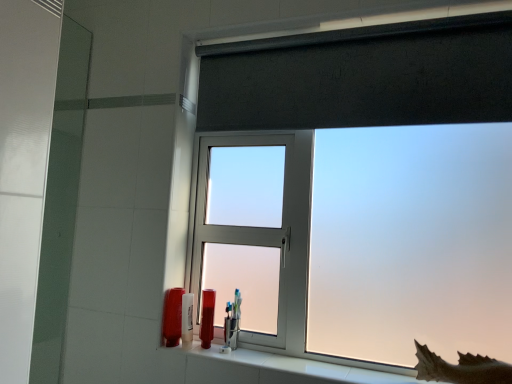
Where is `frosted glass window at upper center`? This screenshot has height=384, width=512. frosted glass window at upper center is located at coordinates (362, 76).

The image size is (512, 384). Describe the element at coordinates (207, 318) in the screenshot. I see `translucent plastic tube at lower center, marked as the second toiletry in a right-to-left arrangement` at that location.

What do you see at coordinates (187, 320) in the screenshot? The image size is (512, 384). I see `translucent plastic toothbrush at lower center, which appears as the third toiletry when viewed from the right` at bounding box center [187, 320].

At what (x,y) coordinates should I click in order to perform the action: click on black textured roller blind at upper center. Please return your answer as a coordinate pair (x, y). This screenshot has width=512, height=384. Looking at the image, I should click on (362, 77).

Where is `matte glass screen door at left`? The height and width of the screenshot is (384, 512). matte glass screen door at left is located at coordinates (24, 167).

Locate an element on the screen. The width and height of the screenshot is (512, 384). frosted plastic shark fin at lower right is located at coordinates (461, 368).

Locate an element on the screen. matte plastic toothbrush at lower left, arranged as the 4th toiletry when viewed from the right is located at coordinates (172, 316).

Which object is thinner, translucent plastic toothbrush at lower center, the second toiletry when ordered from left to right, or clear plastic toothbrush holder at center, the fourth toiletry when ordered from left to right?

With smaller width is translucent plastic toothbrush at lower center, the second toiletry when ordered from left to right.

From a real-world perspective, is translucent plastic toothbrush at lower center, the second toiletry when ordered from left to right, on clear plastic toothbrush holder at center, the fourth toiletry when ordered from left to right?

Incorrect, from a real-world perspective, translucent plastic toothbrush at lower center, the second toiletry when ordered from left to right, is lower than clear plastic toothbrush holder at center, the fourth toiletry when ordered from left to right.

From the image's perspective, is translucent plastic toothbrush at lower center, which appears as the third toiletry when viewed from the right, on top of clear plastic toothbrush holder at center, the 1th toiletry viewed from the right?

Correct, translucent plastic toothbrush at lower center, which appears as the third toiletry when viewed from the right, appears higher than clear plastic toothbrush holder at center, the 1th toiletry viewed from the right, in the image.

Is frosted glass window at upper center thinner than black textured roller blind at upper center?

No.

Could you tell me if frosted glass window at upper center is turned towards black textured roller blind at upper center?

Yes, frosted glass window at upper center is turned towards black textured roller blind at upper center.

Find the location of a particular element. window in front of the black textured roller blind at upper center is located at coordinates (362, 76).

Which of these two, frosted glass window at upper center or black textured roller blind at upper center, is smaller?

black textured roller blind at upper center is smaller.

Considering the relative positions of matte glass screen door at left and frosted plastic shark fin at lower right in the image provided, is matte glass screen door at left to the right of frosted plastic shark fin at lower right from the viewer's perspective?

In fact, matte glass screen door at left is to the left of frosted plastic shark fin at lower right.

Can you confirm if matte glass screen door at left is bigger than frosted plastic shark fin at lower right?

Correct, matte glass screen door at left is larger in size than frosted plastic shark fin at lower right.

The image size is (512, 384). Find the location of `animal located underneath the matte glass screen door at left (from a real-world perspective)`. animal located underneath the matte glass screen door at left (from a real-world perspective) is located at coordinates (461, 368).

Is matte glass screen door at left closer to the viewer compared to frosted plastic shark fin at lower right?

No, it is not.

Is clear plastic toothbrush holder at center, the fourth toiletry when ordered from left to right, thinner than translucent plastic toothbrush at lower center, the second toiletry when ordered from left to right?

In fact, clear plastic toothbrush holder at center, the fourth toiletry when ordered from left to right, might be wider than translucent plastic toothbrush at lower center, the second toiletry when ordered from left to right.

From a real-world perspective, who is located higher, clear plastic toothbrush holder at center, the fourth toiletry when ordered from left to right, or translucent plastic toothbrush at lower center, which appears as the third toiletry when viewed from the right?

clear plastic toothbrush holder at center, the fourth toiletry when ordered from left to right, from a real-world perspective.

Consider the image. Is clear plastic toothbrush holder at center, the 1th toiletry viewed from the right, oriented away from translucent plastic toothbrush at lower center, which appears as the third toiletry when viewed from the right?

clear plastic toothbrush holder at center, the 1th toiletry viewed from the right, is not turned away from translucent plastic toothbrush at lower center, which appears as the third toiletry when viewed from the right.

Is translucent plastic tube at lower center, marked as the second toiletry in a right-to-left arrangement, situated inside frosted plastic shark fin at lower right or outside?

The correct answer is: outside.

Which is farther from the camera, (210, 305) or (442, 364)?

Point (210, 305)

From the image's perspective, is translucent plastic tube at lower center, the 3th toiletry viewed from the left, on top of frosted plastic shark fin at lower right?

Yes, from the image's perspective, translucent plastic tube at lower center, the 3th toiletry viewed from the left, is over frosted plastic shark fin at lower right.

Consider the image. From a real-world perspective, between translucent plastic tube at lower center, marked as the second toiletry in a right-to-left arrangement, and frosted plastic shark fin at lower right, who is vertically higher?

In real-world perspective, translucent plastic tube at lower center, marked as the second toiletry in a right-to-left arrangement, is above.

Is white ceramic window sill at lower center facing towards matte plastic toothbrush at lower left, which ranks as the 1th toiletry in left-to-right order?

No, white ceramic window sill at lower center is not aimed at matte plastic toothbrush at lower left, which ranks as the 1th toiletry in left-to-right order.

Would you consider white ceramic window sill at lower center to be distant from matte plastic toothbrush at lower left, arranged as the 4th toiletry when viewed from the right?

No, white ceramic window sill at lower center is not far from matte plastic toothbrush at lower left, arranged as the 4th toiletry when viewed from the right.

Between white ceramic window sill at lower center and matte plastic toothbrush at lower left, which ranks as the 1th toiletry in left-to-right order, which one has more height?

Standing taller between the two is matte plastic toothbrush at lower left, which ranks as the 1th toiletry in left-to-right order.

Image resolution: width=512 pixels, height=384 pixels. I want to click on window sill lying below the matte plastic toothbrush at lower left, which ranks as the 1th toiletry in left-to-right order (from the image's perspective), so click(x=279, y=367).

Considering the relative sizes of translucent plastic toothbrush at lower center, the second toiletry when ordered from left to right, and white ceramic window sill at lower center in the image provided, is translucent plastic toothbrush at lower center, the second toiletry when ordered from left to right, taller than white ceramic window sill at lower center?

Indeed, translucent plastic toothbrush at lower center, the second toiletry when ordered from left to right, has a greater height compared to white ceramic window sill at lower center.

Could you tell me if translucent plastic toothbrush at lower center, which appears as the third toiletry when viewed from the right, is facing white ceramic window sill at lower center?

Yes, translucent plastic toothbrush at lower center, which appears as the third toiletry when viewed from the right, faces towards white ceramic window sill at lower center.

From the image's perspective, would you say translucent plastic toothbrush at lower center, which appears as the third toiletry when viewed from the right, is shown under white ceramic window sill at lower center?

Actually, translucent plastic toothbrush at lower center, which appears as the third toiletry when viewed from the right, appears above white ceramic window sill at lower center in the image.

The height and width of the screenshot is (384, 512). In order to click on the 2nd toiletry to the left of the clear plastic toothbrush holder at center, the fourth toiletry when ordered from left to right, counting from the anchor's position in this screenshot , I will do `click(187, 320)`.

Find the location of a particular element. Image resolution: width=512 pixels, height=384 pixels. shower curtain on the right of frosted glass window at upper center is located at coordinates click(362, 77).

Based on their spatial positions, is white ceramic window sill at lower center or clear plastic toothbrush holder at center, the 1th toiletry viewed from the right, further from matte glass screen door at left?

clear plastic toothbrush holder at center, the 1th toiletry viewed from the right, is further to matte glass screen door at left.

Considering their positions, is frosted plastic shark fin at lower right positioned closer to matte plastic toothbrush at lower left, which ranks as the 1th toiletry in left-to-right order, than translucent plastic tube at lower center, the 3th toiletry viewed from the left?

The object closer to matte plastic toothbrush at lower left, which ranks as the 1th toiletry in left-to-right order, is translucent plastic tube at lower center, the 3th toiletry viewed from the left.

From the picture: Considering their positions, is matte glass screen door at left positioned closer to translucent plastic tube at lower center, marked as the second toiletry in a right-to-left arrangement, than white ceramic window sill at lower center?

white ceramic window sill at lower center lies closer to translucent plastic tube at lower center, marked as the second toiletry in a right-to-left arrangement, than the other object.

When comparing their distances from translucent plastic toothbrush at lower center, which appears as the third toiletry when viewed from the right, does matte glass screen door at left or matte plastic toothbrush at lower left, arranged as the 4th toiletry when viewed from the right, seem closer?

matte plastic toothbrush at lower left, arranged as the 4th toiletry when viewed from the right, is positioned closer to the anchor translucent plastic toothbrush at lower center, which appears as the third toiletry when viewed from the right.

Looking at the image, which one is located further to frosted glass window at upper center, clear plastic toothbrush holder at center, the fourth toiletry when ordered from left to right, or matte plastic toothbrush at lower left, which ranks as the 1th toiletry in left-to-right order?

Based on the image, matte plastic toothbrush at lower left, which ranks as the 1th toiletry in left-to-right order, appears to be further to frosted glass window at upper center.

Which object lies further to the anchor point matte glass screen door at left, translucent plastic tube at lower center, marked as the second toiletry in a right-to-left arrangement, or frosted glass window at upper center?

Based on the image, frosted glass window at upper center appears to be further to matte glass screen door at left.

Which object lies nearer to the anchor point matte plastic toothbrush at lower left, arranged as the 4th toiletry when viewed from the right, clear plastic toothbrush holder at center, the 1th toiletry viewed from the right, or translucent plastic tube at lower center, marked as the second toiletry in a right-to-left arrangement?

The object closer to matte plastic toothbrush at lower left, arranged as the 4th toiletry when viewed from the right, is translucent plastic tube at lower center, marked as the second toiletry in a right-to-left arrangement.

From the image, which object appears to be farther from translucent plastic tube at lower center, marked as the second toiletry in a right-to-left arrangement, frosted glass window at upper center or frosted plastic shark fin at lower right?

frosted glass window at upper center lies further to translucent plastic tube at lower center, marked as the second toiletry in a right-to-left arrangement, than the other object.

The height and width of the screenshot is (384, 512). In order to click on toiletry between matte glass screen door at left and translucent plastic toothbrush at lower center, which appears as the third toiletry when viewed from the right, in the horizontal direction in this screenshot , I will do `click(172, 316)`.

Locate an element on the screen. The image size is (512, 384). toiletry between translucent plastic toothbrush at lower center, which appears as the third toiletry when viewed from the right, and clear plastic toothbrush holder at center, the fourth toiletry when ordered from left to right is located at coordinates (207, 318).

Image resolution: width=512 pixels, height=384 pixels. Identify the location of window between matte glass screen door at left and black textured roller blind at upper center from left to right. (362, 76).

Find the location of a particular element. The height and width of the screenshot is (384, 512). window sill between matte plastic toothbrush at lower left, which ranks as the 1th toiletry in left-to-right order, and frosted plastic shark fin at lower right is located at coordinates (279, 367).